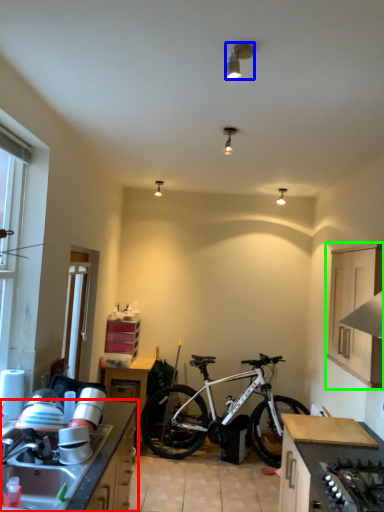
Question: Considering the real-world distances, which object is farthest from countertop (highlighted by a red box)? lamp (highlighted by a blue box) or cabinetry (highlighted by a green box)?

Choices:
 (A) lamp
 (B) cabinetry

Answer: (A)